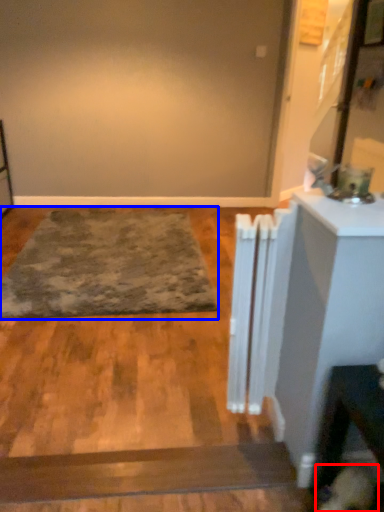
Question: Which of the following is the farthest to the observer, dog (highlighted by a red box) or mat (highlighted by a blue box)?

Choices:
 (A) dog
 (B) mat

Answer: (B)